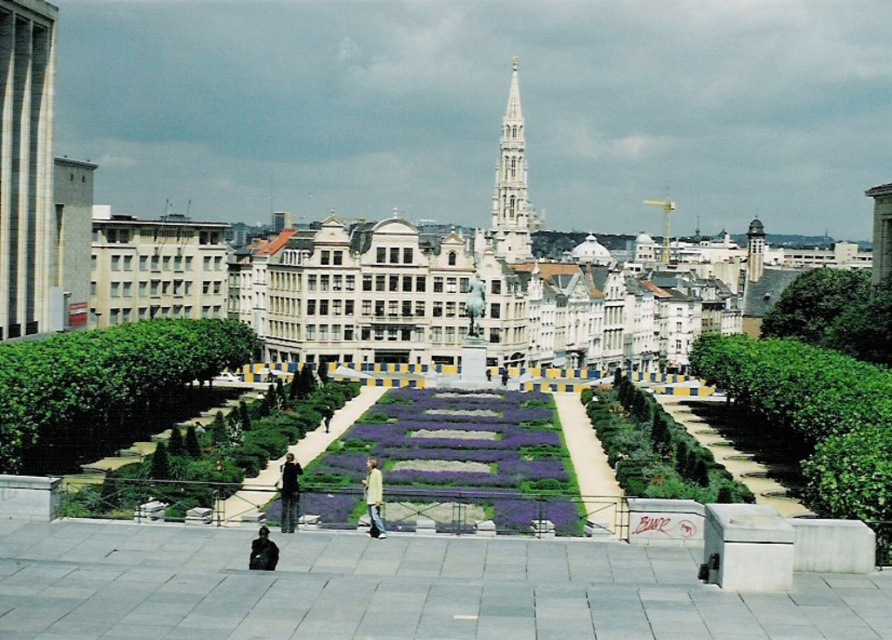
Question: Which point is closer to the camera?

Choices:
 (A) (519, 253)
 (B) (37, 221)

Answer: (B)

Question: Is white textured tower at left bigger than white marble spire at center?

Choices:
 (A) yes
 (B) no

Answer: (B)

Question: Among these objects, which one is nearest to the camera?

Choices:
 (A) white marble spire at center
 (B) white textured tower at left

Answer: (B)

Question: Is white textured tower at left behind white marble spire at center?

Choices:
 (A) no
 (B) yes

Answer: (A)

Question: Which point appears farthest from the camera in this image?

Choices:
 (A) (48, 211)
 (B) (510, 179)

Answer: (B)

Question: Does white textured tower at left appear on the right side of white marble spire at center?

Choices:
 (A) yes
 (B) no

Answer: (B)